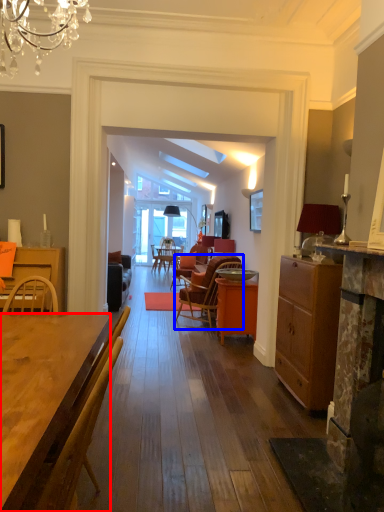
Question: Which object is further to the camera taking this photo, desk (highlighted by a red box) or chair (highlighted by a blue box)?

Choices:
 (A) desk
 (B) chair

Answer: (B)